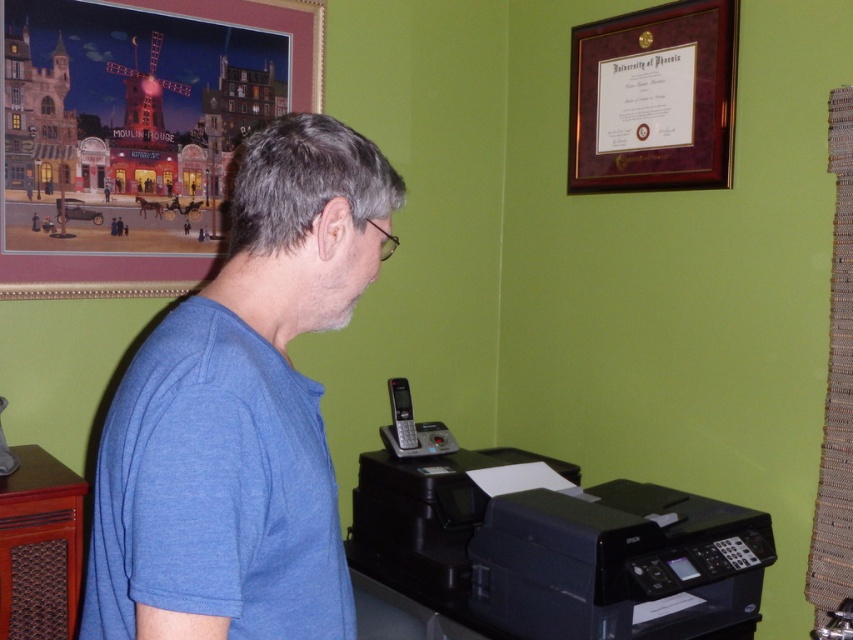
Question: Which point is farther to the camera?

Choices:
 (A) black plastic printer at lower center
 (B) metallic mesh bulletin board at right
 (C) black plastic printer at lower right

Answer: (A)

Question: Considering the real-world distances, which object is farthest from the maroon wood picture frame at upper right?

Choices:
 (A) metallic mesh bulletin board at right
 (B) wooden framed painting at upper left
 (C) black plastic printer at lower center

Answer: (C)

Question: Can you confirm if blue cotton shirt at center is bigger than maroon wood picture frame at upper right?

Choices:
 (A) yes
 (B) no

Answer: (B)

Question: Which of the following is the closest to the observer?

Choices:
 (A) blue cotton shirt at center
 (B) black plastic printer at lower center

Answer: (A)

Question: Can you confirm if maroon wood picture frame at upper right is smaller than metallic mesh bulletin board at right?

Choices:
 (A) yes
 (B) no

Answer: (B)

Question: Can you confirm if wooden framed painting at upper left is thinner than metallic mesh bulletin board at right?

Choices:
 (A) no
 (B) yes

Answer: (A)